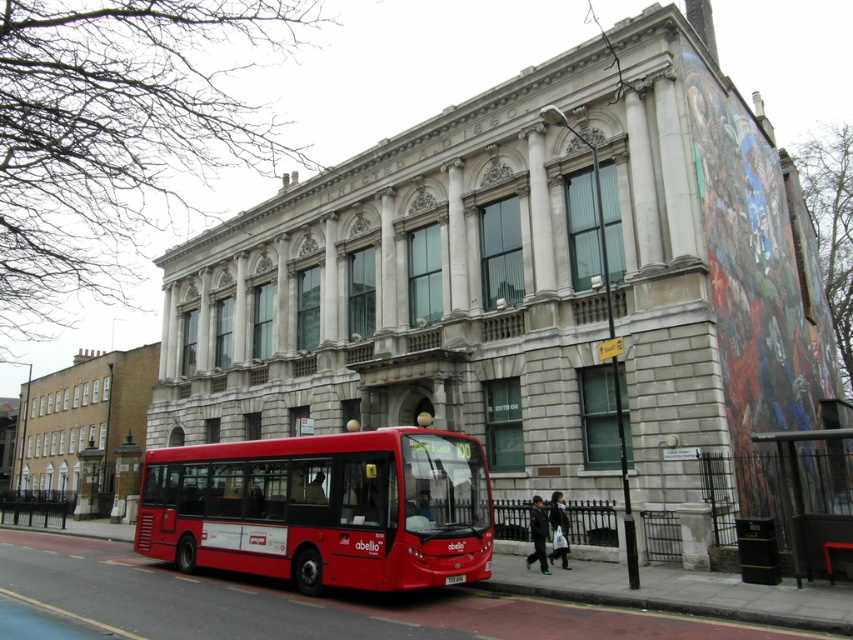
Looking at this image, between shiny red bus at center and metallic black bus stop at lower right, which one is positioned lower?

Positioned lower is shiny red bus at center.

Is shiny red bus at center to the left of metallic black bus stop at lower right from the viewer's perspective?

Indeed, shiny red bus at center is positioned on the left side of metallic black bus stop at lower right.

Which is in front, point (432, 525) or point (781, 486)?

Point (432, 525) is more forward.

Where is `shiny red bus at center`? shiny red bus at center is located at coordinates (323, 508).